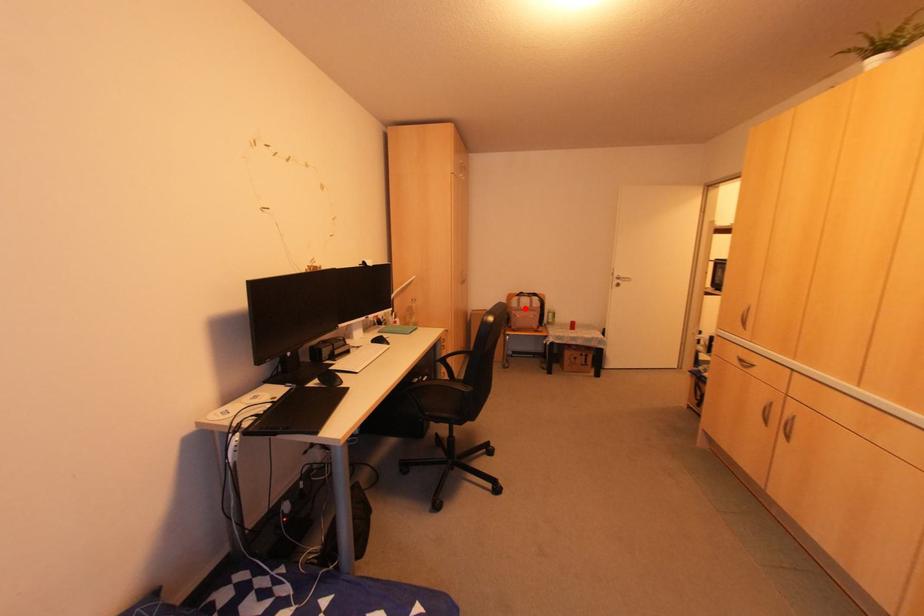
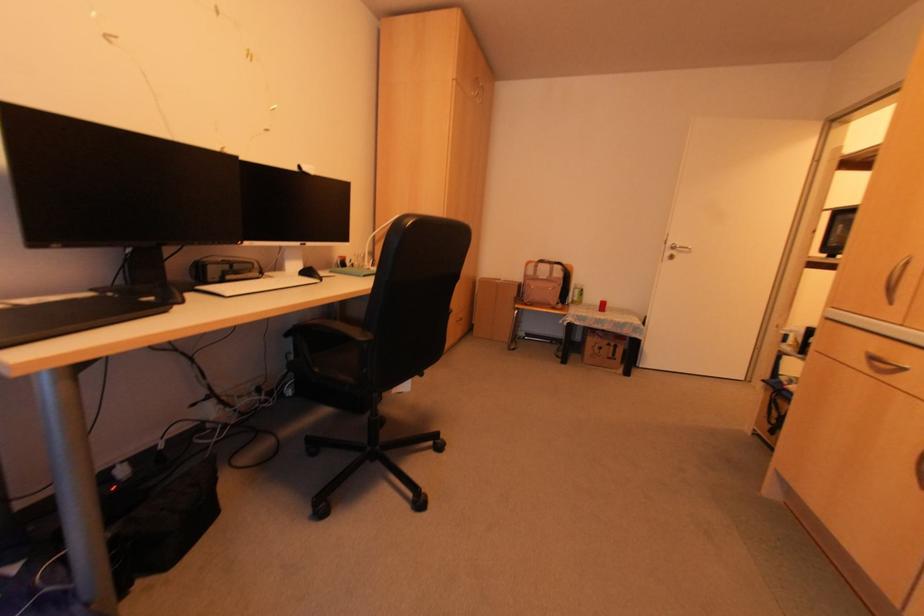
Where in the second image is the point corresponding to the highlighted location from the first image?

(542, 278)